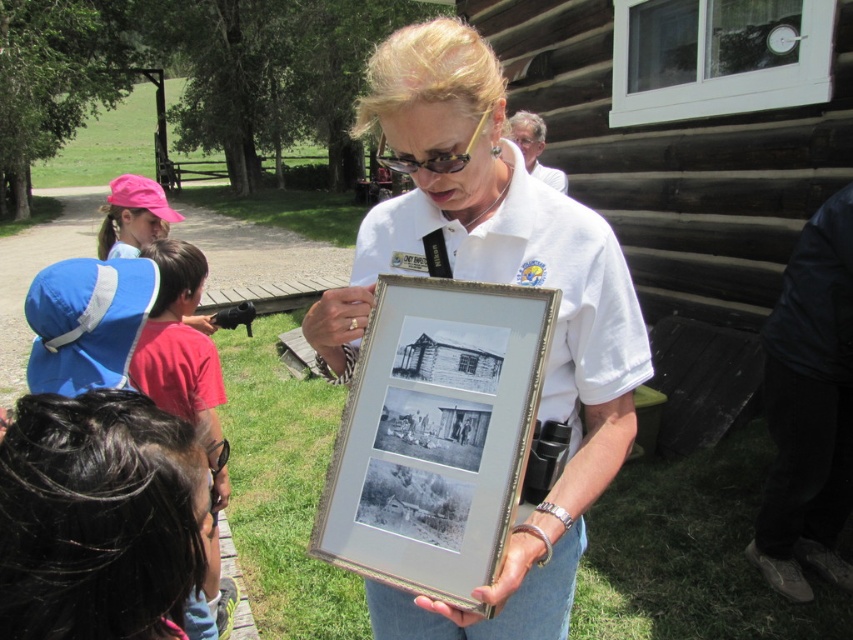
Question: Does dark blue leather jacket at lower right come in front of matte white shirt at upper center?

Choices:
 (A) no
 (B) yes

Answer: (B)

Question: Is black hair at lower left below red cotton shirt at lower left?

Choices:
 (A) no
 (B) yes

Answer: (A)

Question: Among these objects, which one is nearest to the camera?

Choices:
 (A) metallic frame at center
 (B) red cotton shirt at lower left

Answer: (B)

Question: Is the position of dark blue leather jacket at lower right less distant than that of red cotton shirt at lower left?

Choices:
 (A) yes
 (B) no

Answer: (B)

Question: Which of the following is the closest to the observer?

Choices:
 (A) silver/golden metallic picture frame at center
 (B) metallic frame at center

Answer: (A)

Question: Which of these objects is positioned farthest from the red cotton shirt at lower left?

Choices:
 (A) black hair at lower left
 (B) dark blue leather jacket at lower right

Answer: (B)